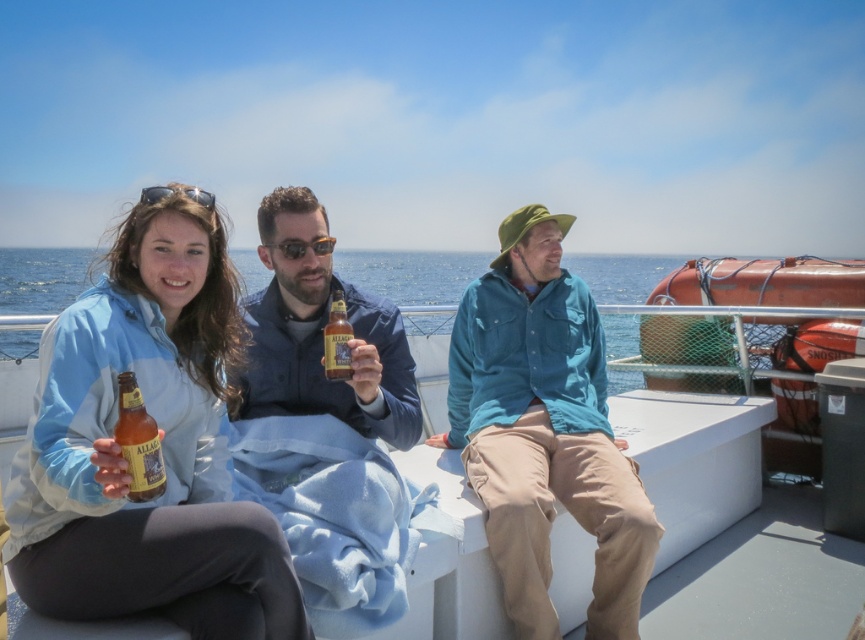
You are standing on the deck of a boat and see the amber glass bottle at lower left. You want to grab it but need to know if it is within reach. Your outstretched arm can reach up to 1.5 meters. Can you reach it?

The amber glass bottle at lower left is 1.43 meters away from the viewer. Since your arm can reach up to 1.5 meters, you can reach the amber glass bottle at lower left.

You are a photographer trying to capture the teal cotton shirt at center in the image. Where should you focus your camera to ensure it is in the center of the frame?

You should focus your camera at point [543,432] to ensure the teal cotton shirt at center is in the center of the frame.